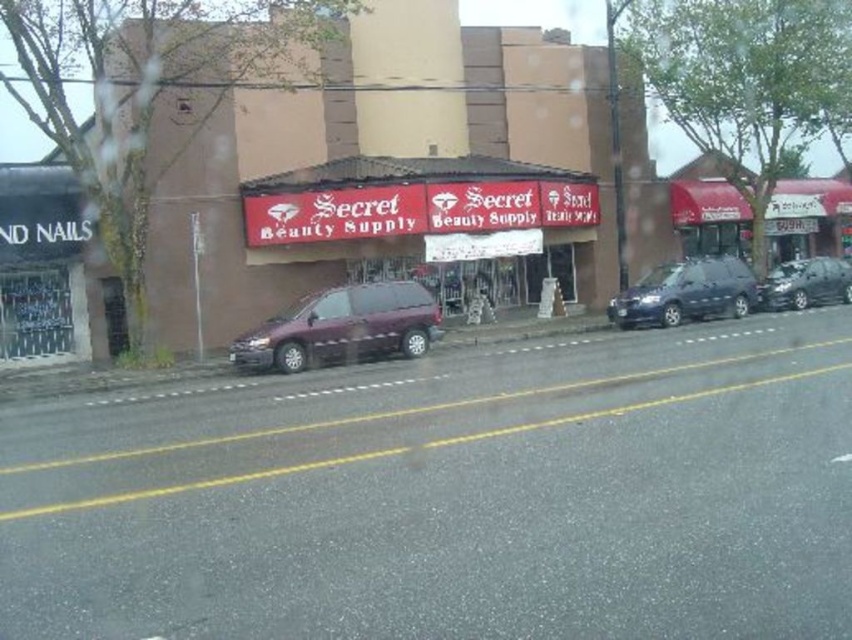
You are standing at the point marked by the coordinate point at (429,221). Looking around, you see a red matte signboard at center. Which direction should you face to see the Secret Beauty Supply building on the left side of the street?

The point at (429,221) is on the red matte signboard at center. To see the Secret Beauty Supply building on the left side of the street, you should face towards the left side of the street where the building is located.

You are a delivery driver navigating the street and need to deliver a package to the red matte signboard at center. The GPS shows your current position is at point 0.348, 0.505. Are you already at the correct location?

Yes, you are already at the correct location because the red matte signboard at center is located at point (429, 221).

You are a delivery driver who needs to park your van, which is 18 feet long, between the satin black minivan at center and the shiny black sedan at center. Based on the scene, can you fit your van in that space?

The distance between the satin black minivan at center and the shiny black sedan at center is 22.43 feet. Since your van is 18 feet long, there is enough space to park it between them.